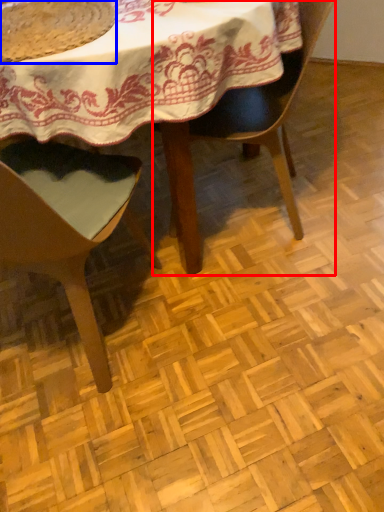
Question: Which point is closer to the camera, chair (highlighted by a red box) or food (highlighted by a blue box)?

Choices:
 (A) chair
 (B) food

Answer: (B)